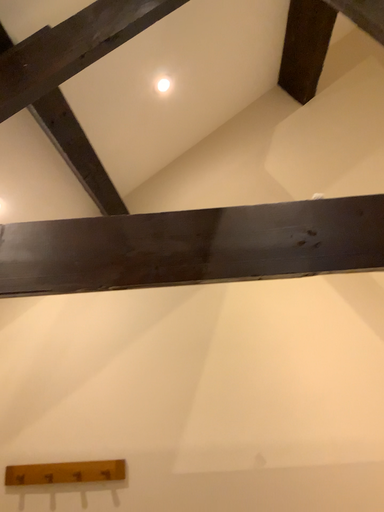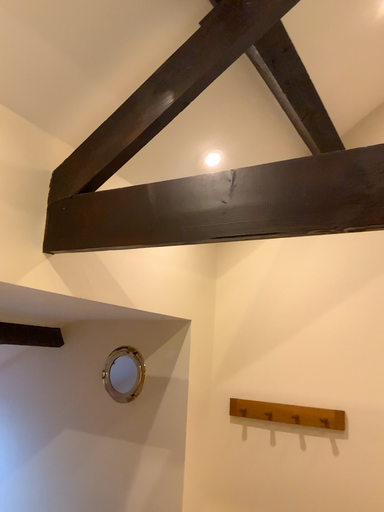
Question: Which way did the camera rotate in the video?

Choices:
 (A) rotated left
 (B) rotated right

Answer: (A)